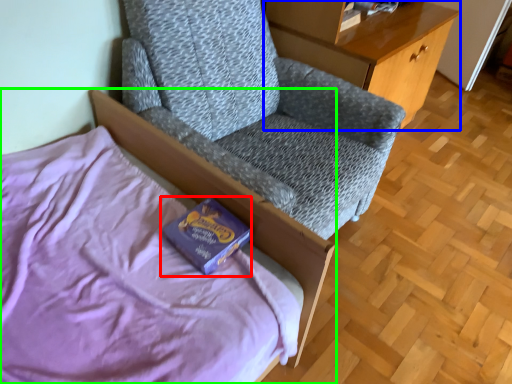
Question: Based on their relative distances, which object is nearer to paperback book (highlighted by a red box)? Choose from desk (highlighted by a blue box) and bed (highlighted by a green box).

Choices:
 (A) desk
 (B) bed

Answer: (B)